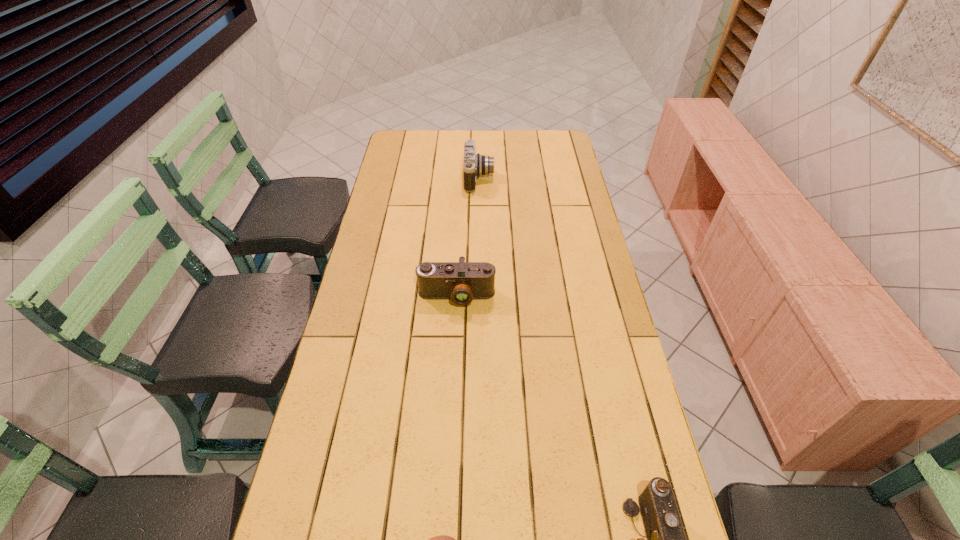
Identify the location of free spot between the farthest object and the third nearest object. (468, 237).

The height and width of the screenshot is (540, 960). Identify the location of vacant area between the farthest object and the second farthest object. (468, 237).

The height and width of the screenshot is (540, 960). I want to click on object that is the third nearest to the rightmost camera, so click(474, 164).

Image resolution: width=960 pixels, height=540 pixels. What are the coordinates of `the closest object to the nearest camera` in the screenshot? It's located at [442, 539].

Image resolution: width=960 pixels, height=540 pixels. Find the location of `camera that is the closest to the shortest object`. camera that is the closest to the shortest object is located at coordinates (666, 539).

Locate which camera ranks second in proximity to the farthest object. Please provide its 2D coordinates. Your answer should be formatted as a tuple, i.e. [(x, y)], where the tuple contains the x and y coordinates of a point satisfying the conditions above.

[(666, 539)]

I want to click on vacant space that satisfies the following two spatial constraints: 1. on the front-facing side of the farthest camera; 2. on the lens of the second farthest camera, so click(479, 296).

At what (x,y) coordinates should I click in order to perform the action: click on free region that satisfies the following two spatial constraints: 1. on the front-facing side of the farthest object; 2. on the lens of the second farthest camera. Please return your answer as a coordinate pair (x, y). Looking at the image, I should click on (479, 296).

Find the location of a particular element. vacant region that satisfies the following two spatial constraints: 1. on the front-facing side of the farthest camera; 2. on the lens of the second farthest object is located at coordinates (479, 296).

This screenshot has width=960, height=540. Find the location of `free region that satisfies the following two spatial constraints: 1. on the front-facing side of the farthest object; 2. on the lens of the second nearest camera`. free region that satisfies the following two spatial constraints: 1. on the front-facing side of the farthest object; 2. on the lens of the second nearest camera is located at coordinates (479, 296).